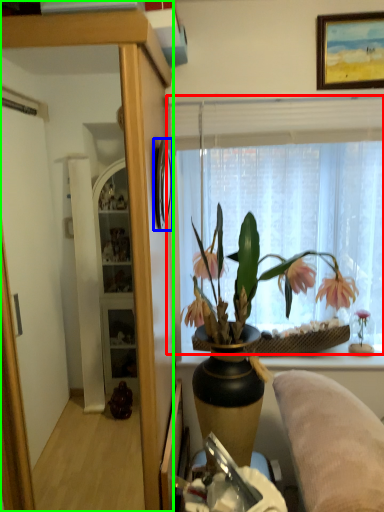
Question: Estimate the real-world distances between objects in this image. Which object is closer to window (highlighted by a red box), picture frame (highlighted by a blue box) or cabinetry (highlighted by a green box)?

Choices:
 (A) picture frame
 (B) cabinetry

Answer: (A)